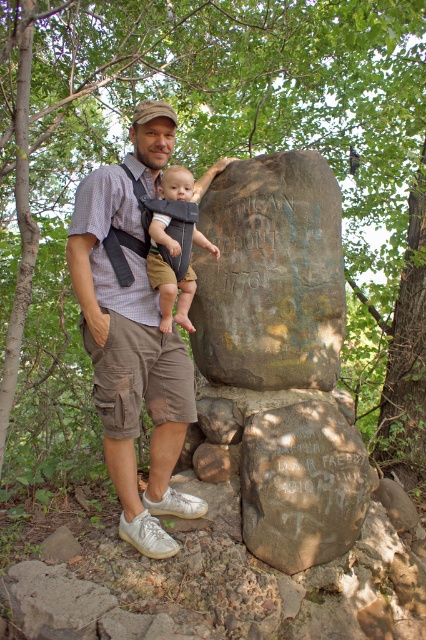
Question: Among these points, which one is farthest from the camera?

Choices:
 (A) (132, 320)
 (B) (270, 225)
 (C) (158, 280)
 (D) (296, 417)

Answer: (B)

Question: Which point appears farthest from the camera in this image?

Choices:
 (A) (310, 314)
 (B) (293, 177)

Answer: (B)

Question: Does brown rough stone at center appear over brown cotton shirt at center?

Choices:
 (A) yes
 (B) no

Answer: (B)

Question: Which point is closer to the camera taking this photo?

Choices:
 (A) (104, 292)
 (B) (319, 244)
 (C) (181, 308)
 (D) (207, 257)

Answer: (A)

Question: Is brown rough stone at center further to the viewer compared to light brown fabric baby carrier at center?

Choices:
 (A) no
 (B) yes

Answer: (A)

Question: Does brown rough stone at center appear over light brown fabric baby carrier at center?

Choices:
 (A) no
 (B) yes

Answer: (A)